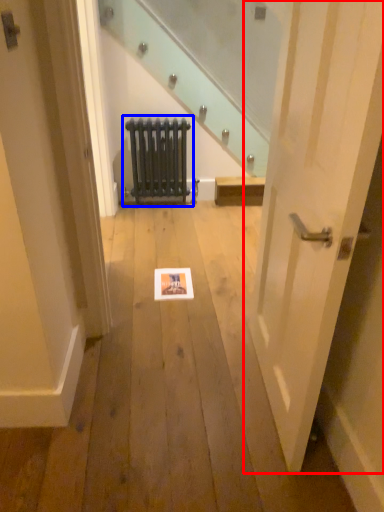
Question: Among these objects, which one is nearest to the camera, door (highlighted by a red box) or radiator (highlighted by a blue box)?

Choices:
 (A) door
 (B) radiator

Answer: (A)